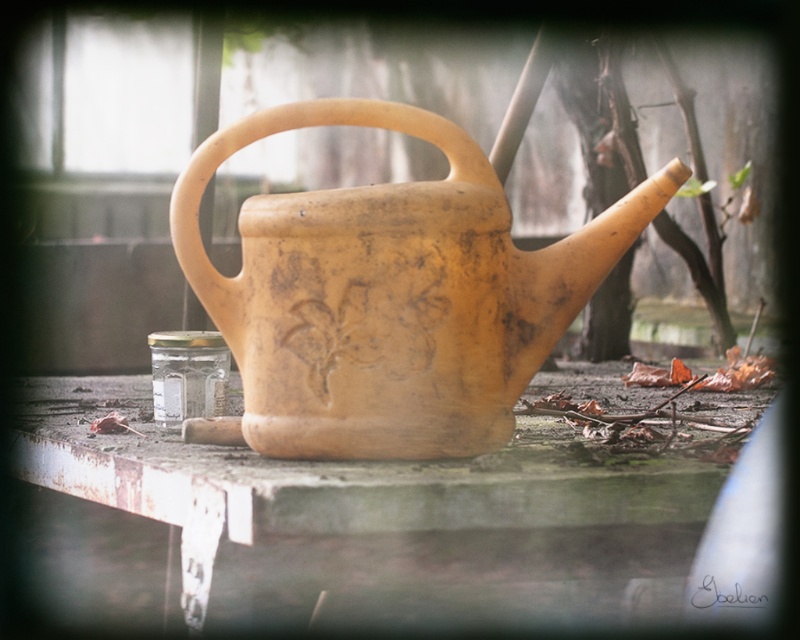
Question: Is rusty metal table at center above matte yellow clay watering can at center?

Choices:
 (A) yes
 (B) no

Answer: (B)

Question: Which of the following is the closest to the observer?

Choices:
 (A) coord(424,320)
 (B) coord(674,445)

Answer: (A)

Question: Which of the following is the farthest from the observer?

Choices:
 (A) (612, 500)
 (B) (246, 122)

Answer: (B)

Question: Does rusty metal table at center appear on the left side of matte yellow clay watering can at center?

Choices:
 (A) yes
 (B) no

Answer: (A)

Question: Which point is farther from the camera taking this photo?

Choices:
 (A) (246, 392)
 (B) (164, 468)

Answer: (A)

Question: Is rusty metal table at center in front of matte yellow clay watering can at center?

Choices:
 (A) no
 (B) yes

Answer: (B)